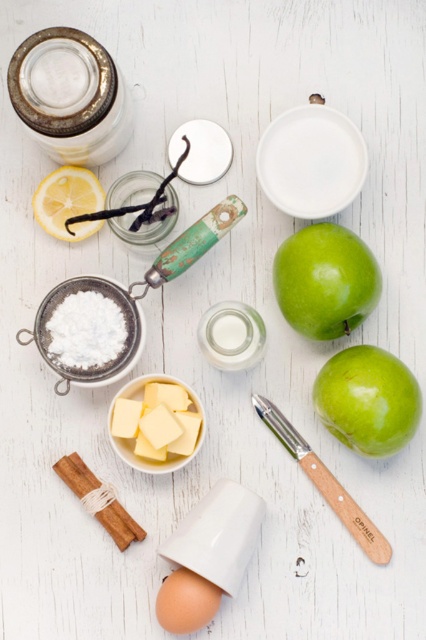
Question: Which point is farther to the camera?

Choices:
 (A) (123, 438)
 (B) (166, 189)

Answer: (B)

Question: Does green matte apple at center right come behind brown matte egg at lower center?

Choices:
 (A) no
 (B) yes

Answer: (B)

Question: Estimate the real-world distances between objects in this image. Which object is farther from the green matte apple at lower right?

Choices:
 (A) yellow matte lemon at upper left
 (B) clear glass jar at upper left
 (C) brown matte egg at lower center
 (D) yellow butter at center

Answer: (B)

Question: Is clear glass jar at upper left smaller than green matte apple at lower right?

Choices:
 (A) yes
 (B) no

Answer: (B)

Question: Can you confirm if clear glass jar at upper left is positioned to the right of yellow butter at center?

Choices:
 (A) no
 (B) yes

Answer: (A)

Question: Based on their relative distances, which object is nearer to the wooden-handled peeler at lower center?

Choices:
 (A) white powdered sugar at center left
 (B) clear glass jar at upper left
 (C) yellow matte lemon at upper left
 (D) green matte apple at lower right

Answer: (D)